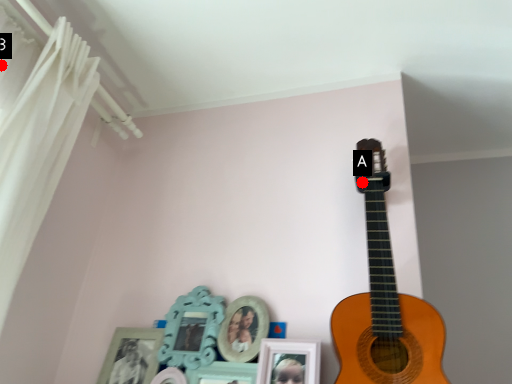
Question: Two points are circled on the image, labeled by A and B beside each circle. Which of the following is the closest to the observer?

Choices:
 (A) A is closer
 (B) B is closer

Answer: (B)